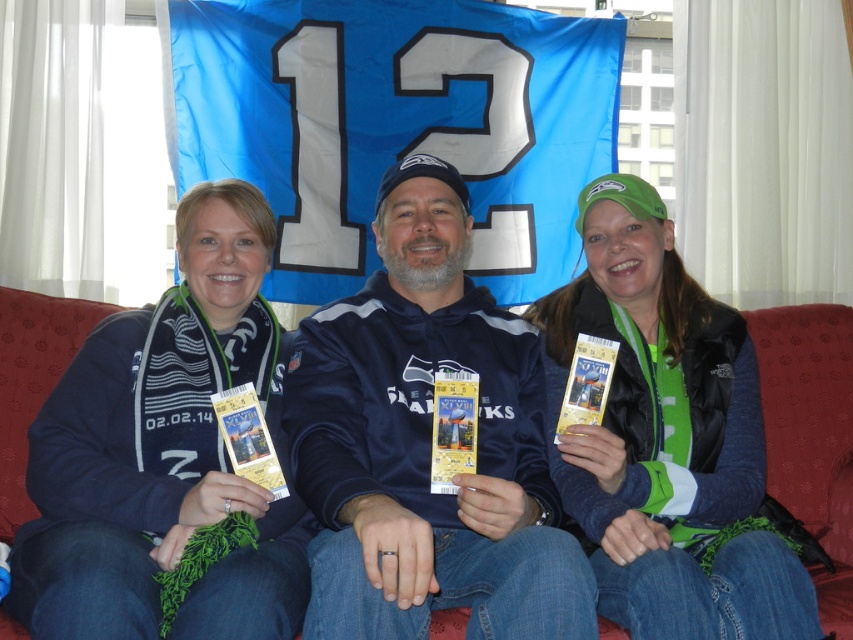
Question: Estimate the real-world distances between objects in this image. Which object is closer to the dark blue hoodie at center?

Choices:
 (A) green fabric vest at center
 (B) red fabric couch at center

Answer: (A)

Question: Which is farther from the red fabric couch at center?

Choices:
 (A) green fabric vest at center
 (B) dark blue fleece jacket at center

Answer: (B)

Question: Does dark blue hoodie at center appear over green fabric vest at center?

Choices:
 (A) yes
 (B) no

Answer: (A)

Question: Is dark blue fleece jacket at center below red fabric couch at center?

Choices:
 (A) yes
 (B) no

Answer: (B)

Question: Which of these objects is positioned closest to the dark blue fleece jacket at center?

Choices:
 (A) dark blue hoodie at center
 (B) red fabric couch at center

Answer: (A)

Question: Can you confirm if dark blue hoodie at center is smaller than green fabric vest at center?

Choices:
 (A) yes
 (B) no

Answer: (B)